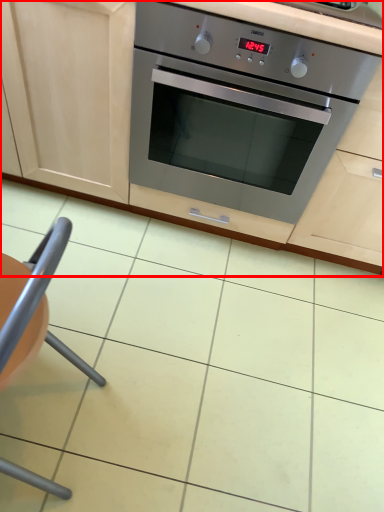
Question: Where is cabinetry (annotated by the red box) located in relation to armchair in the image?

Choices:
 (A) left
 (B) right

Answer: (B)